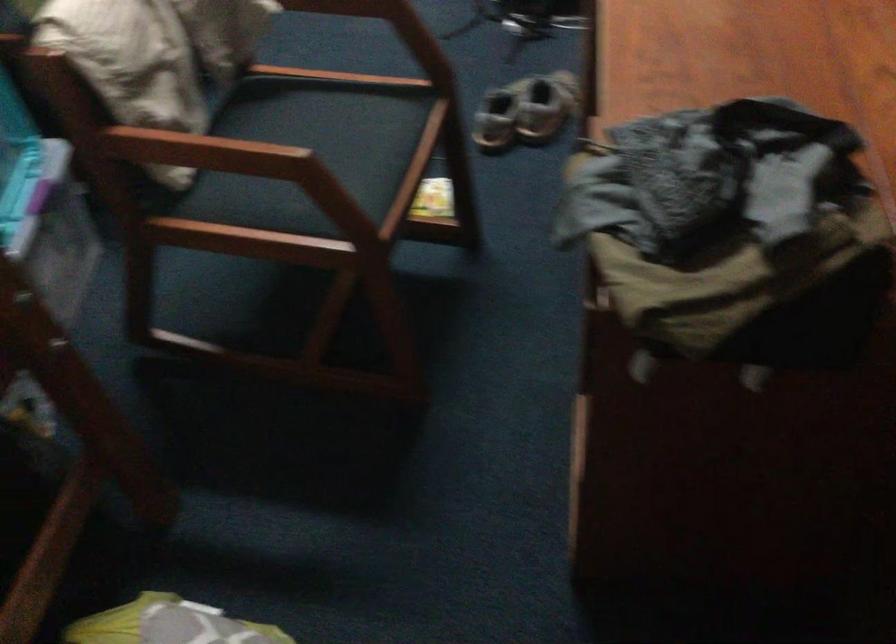
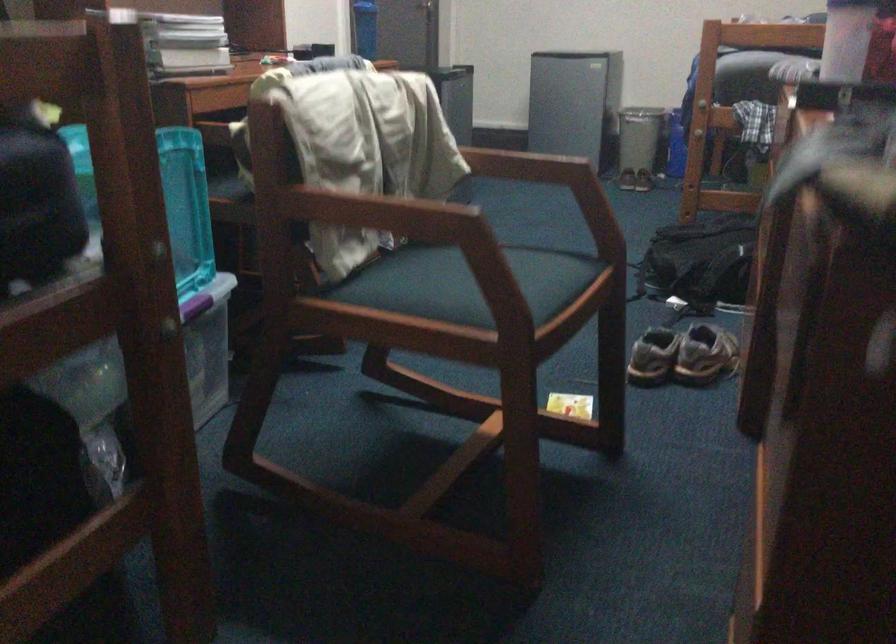
The point at (521,120) is marked in the first image. Where is the corresponding point in the second image?

(682, 355)